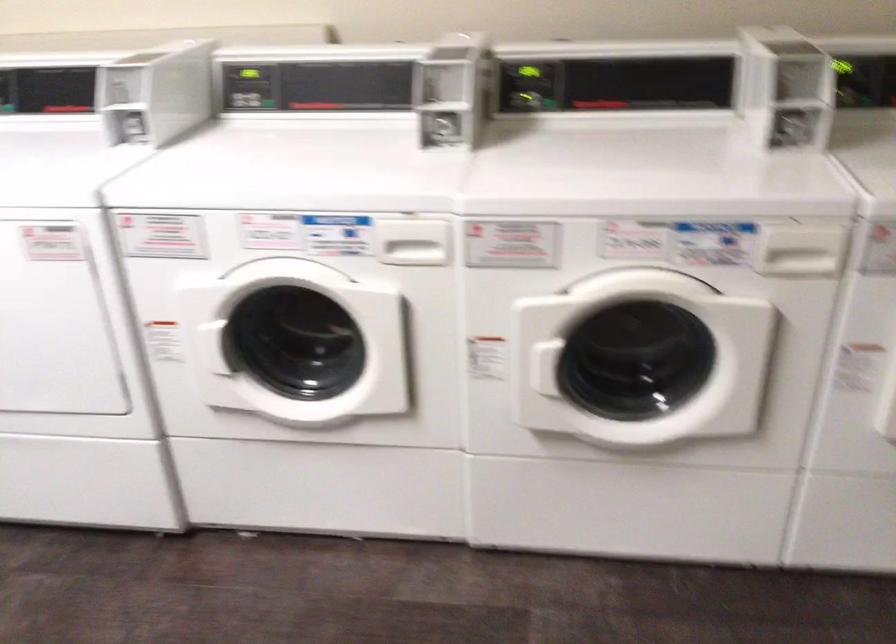
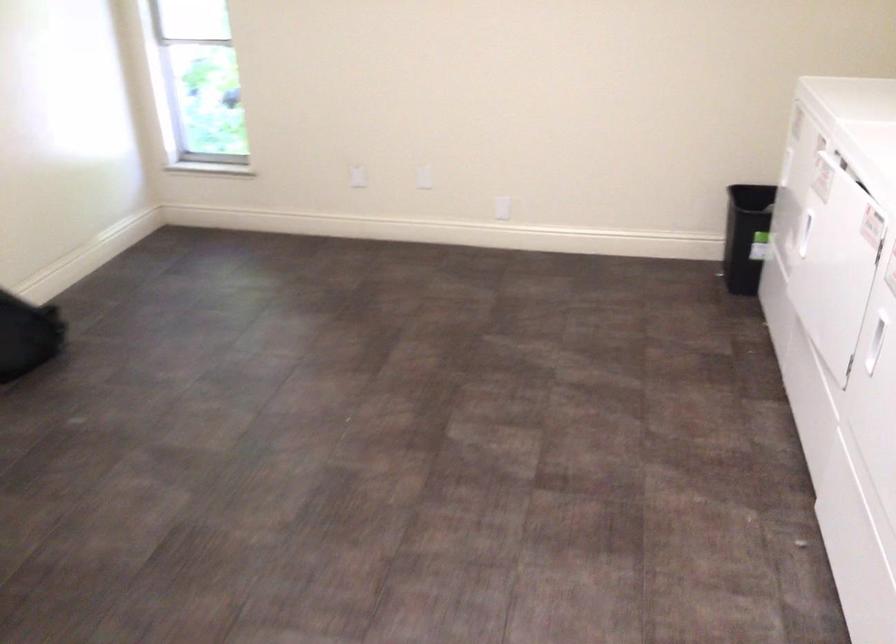
First-person continuous shooting, in which direction is the camera rotating?

The camera rotated toward left-down.